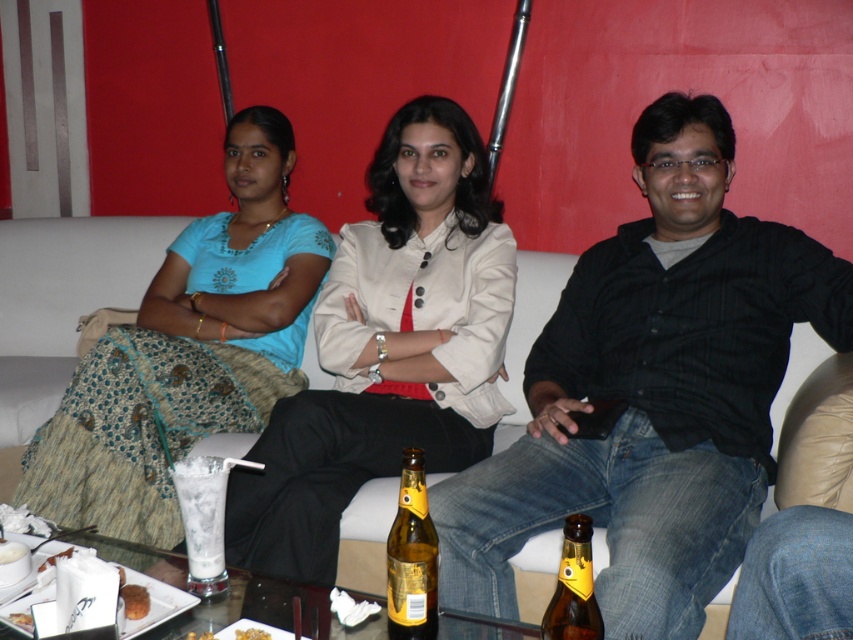
Who is lower down, black cotton shirt at center or white fabric couch at center?

black cotton shirt at center is below.

Is black cotton shirt at center wider than white fabric couch at center?

Correct, the width of black cotton shirt at center exceeds that of white fabric couch at center.

Is point (712, 232) positioned behind point (502, 385)?

That is False.

Image resolution: width=853 pixels, height=640 pixels. In order to click on black cotton shirt at center in this screenshot , I will do `click(653, 392)`.

Between matte blue blouse at center and brown glass bottle at center, which one has less height?

With less height is brown glass bottle at center.

Between point (225, 324) and point (573, 554), which one is positioned in front?

Positioned in front is point (573, 554).

Between point (254, 280) and point (601, 637), which one is positioned in front?

Positioned in front is point (601, 637).

Identify the location of matte blue blouse at center. The image size is (853, 640). (189, 352).

Is matte beige blazer at center wider than brown glass bottle at center?

Yes, matte beige blazer at center is wider than brown glass bottle at center.

What do you see at coordinates (387, 348) in the screenshot? I see `matte beige blazer at center` at bounding box center [387, 348].

Does point (422, 193) come behind point (583, 564)?

Yes, it is behind point (583, 564).

Identify the location of matte beige blazer at center. (387, 348).